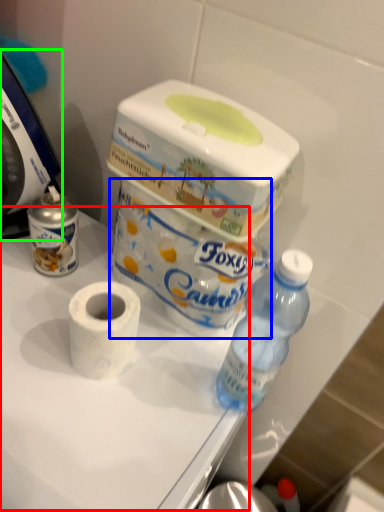
Question: Which object is the farthest from table (highlighted by a red box)? Choose among these: toilet paper (highlighted by a blue box) or food processor (highlighted by a green box).

Choices:
 (A) toilet paper
 (B) food processor

Answer: (B)